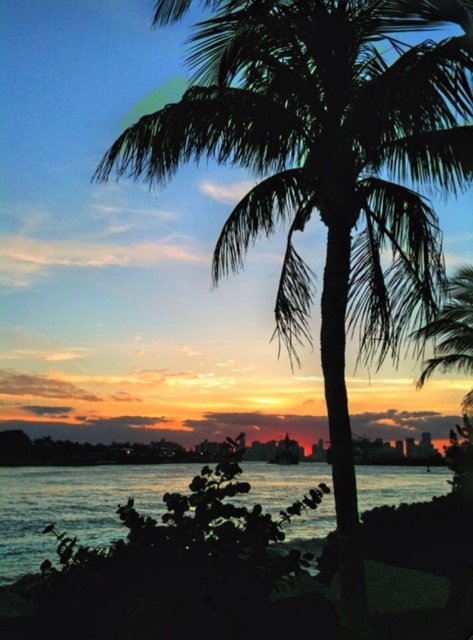
Question: Which point is closer to the camera?

Choices:
 (A) dark blue water at lower center
 (B) silky orange sky at center
 (C) green leafy palm tree at right

Answer: (A)

Question: Is silky orange sky at center closer to the viewer compared to green leafy palm tree at right?

Choices:
 (A) no
 (B) yes

Answer: (B)

Question: From the image, what is the correct spatial relationship of dark blue water at lower center in relation to green leafy palm tree at right?

Choices:
 (A) left
 (B) right

Answer: (A)

Question: Which of the following is the farthest from the observer?

Choices:
 (A) green leafy palm tree at right
 (B) silky orange sky at center

Answer: (A)

Question: Does silky orange sky at center have a smaller size compared to green leafy palm tree at right?

Choices:
 (A) no
 (B) yes

Answer: (A)

Question: Which point is farther to the camera?

Choices:
 (A) (333, 516)
 (B) (432, 332)
 (C) (17, 461)

Answer: (B)